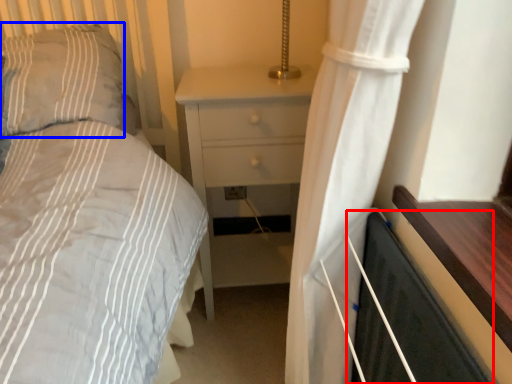
Question: Among these objects, which one is farthest to the camera, screen door (highlighted by a red box) or pillow (highlighted by a blue box)?

Choices:
 (A) screen door
 (B) pillow

Answer: (B)